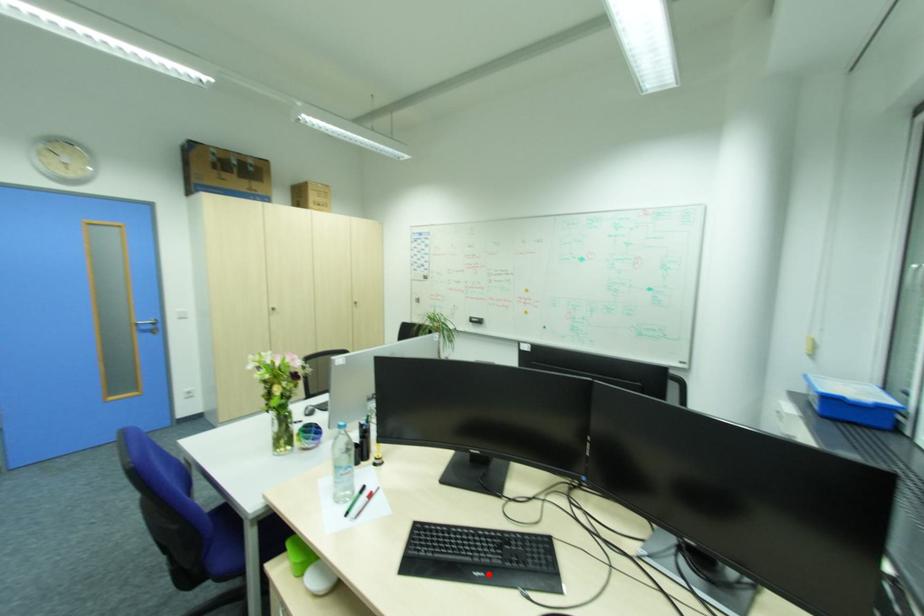
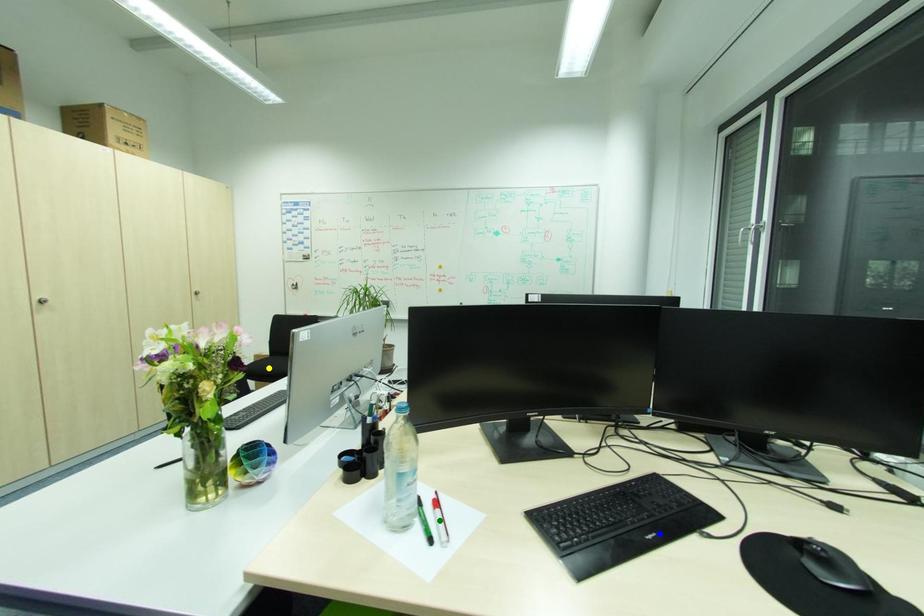
Question: I am providing you with two images of the same scene from different viewpoints. A red point is marked on the first image. You are given multiple points on the second image. Which point in image 2 represents the same 3d spot as the red point in image 1?

Choices:
 (A) yellow point
 (B) blue point
 (C) green point

Answer: (B)